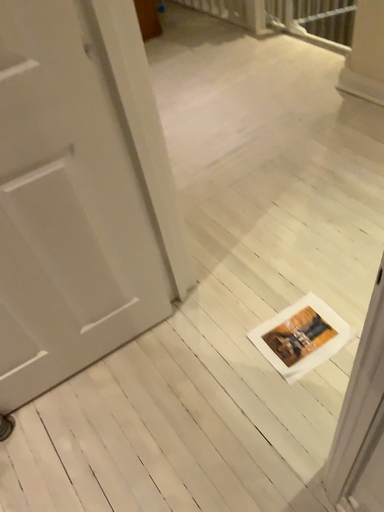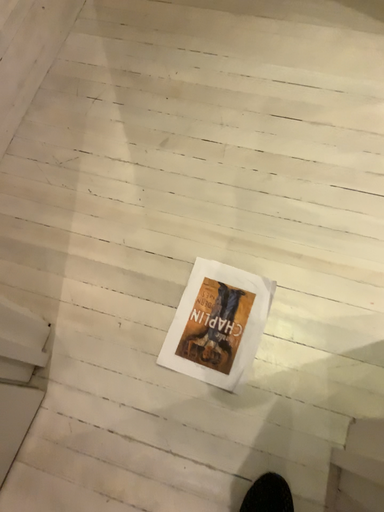
Question: Which way did the camera rotate in the video?

Choices:
 (A) rotated right
 (B) rotated left

Answer: (A)